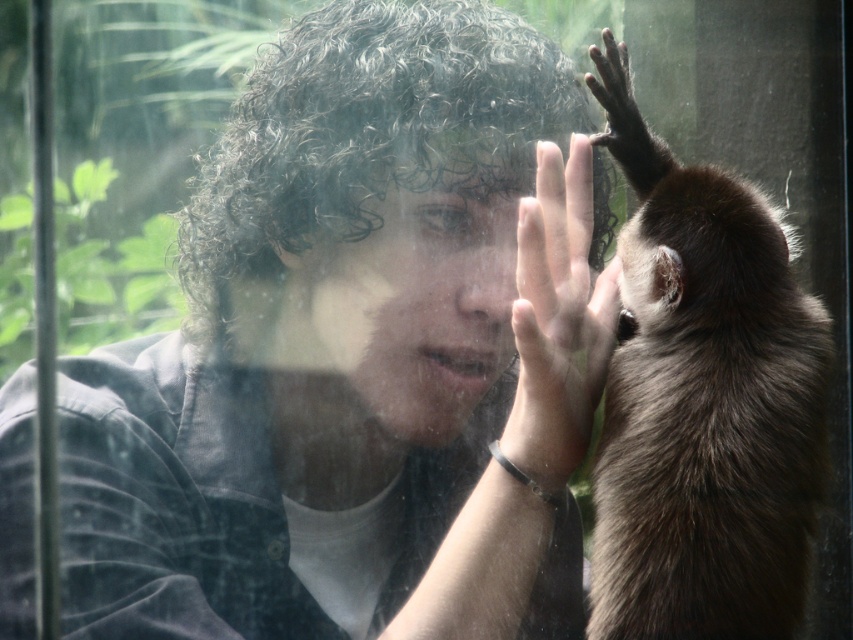
Is point (312, 253) less distant than point (543, 228)?

No, it is not.

Looking at this image, between matte black shirt at center and smooth skin hand at center, which one appears on the right side from the viewer's perspective?

smooth skin hand at center is more to the right.

Is point (108, 480) less distant than point (579, 180)?

No, (108, 480) is further to viewer.

Identify the location of matte black shirt at center. (358, 353).

Is point (392, 6) positioned before point (741, 355)?

No, (392, 6) is behind (741, 355).

Is matte black shirt at center below brown furry monkey at upper right?

Yes, matte black shirt at center is below brown furry monkey at upper right.

Who is more distant from viewer, [271,608] or [711,499]?

The point [271,608] is behind.

Where is `matte black shirt at center`? The height and width of the screenshot is (640, 853). matte black shirt at center is located at coordinates (358, 353).

Does brown furry monkey at upper right have a greater height compared to smooth skin hand at center?

Indeed, brown furry monkey at upper right has a greater height compared to smooth skin hand at center.

Is point (786, 544) positioned before point (556, 417)?

Yes, point (786, 544) is closer to viewer.

The height and width of the screenshot is (640, 853). Identify the location of brown furry monkey at upper right. (703, 401).